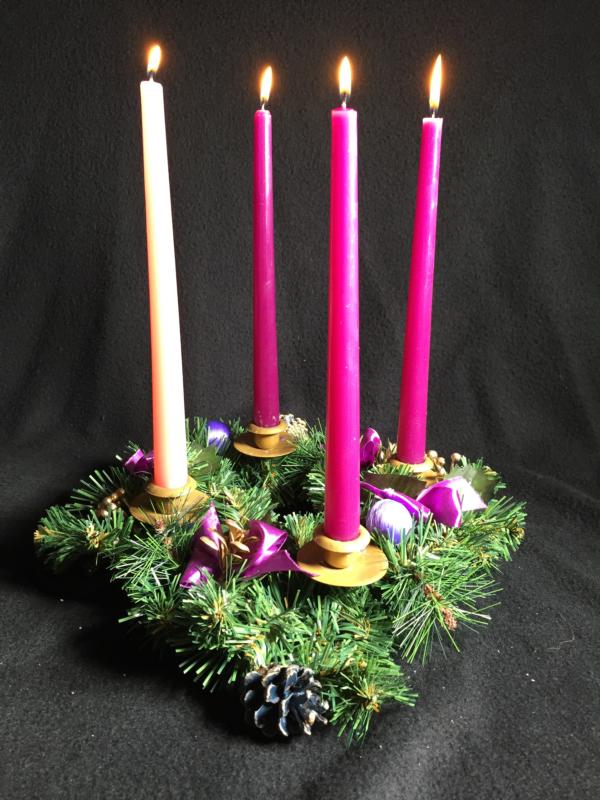
Where is `blanket`? Image resolution: width=600 pixels, height=800 pixels. blanket is located at coordinates (444, 757).